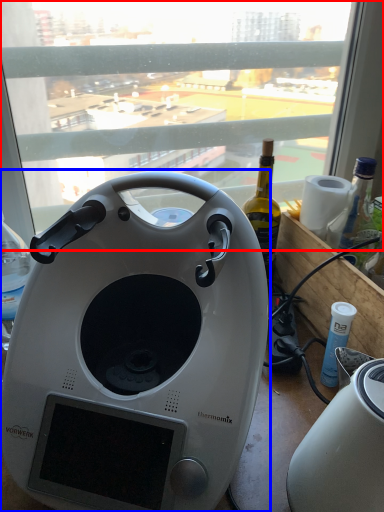
Question: Which of the following is the closest to the observer, window (highlighted by a red box) or home appliance (highlighted by a blue box)?

Choices:
 (A) window
 (B) home appliance

Answer: (B)